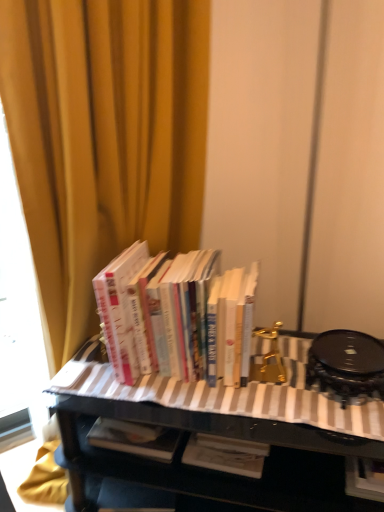
Question: From the image's perspective, is hardcover books at center above or below yellow fabric curtain at upper left?

Choices:
 (A) below
 (B) above

Answer: (A)

Question: From a real-world perspective, relative to yellow fabric curtain at upper left, is hardcover books at center vertically above or below?

Choices:
 (A) above
 (B) below

Answer: (B)

Question: Estimate the real-world distances between objects in this image. Which object is closer to the black glossy table at center?

Choices:
 (A) yellow fabric curtain at upper left
 (B) hardcover books at center

Answer: (B)

Question: Which object is the closest to the yellow fabric curtain at upper left?

Choices:
 (A) black glossy table at center
 (B) hardcover books at center

Answer: (B)